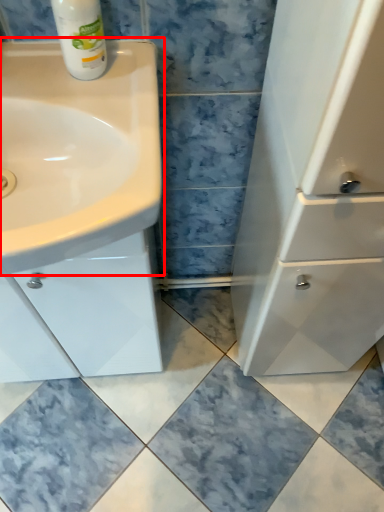
Question: From the image's perspective, where is sink (annotated by the red box) located relative to cleaning product?

Choices:
 (A) above
 (B) below

Answer: (B)